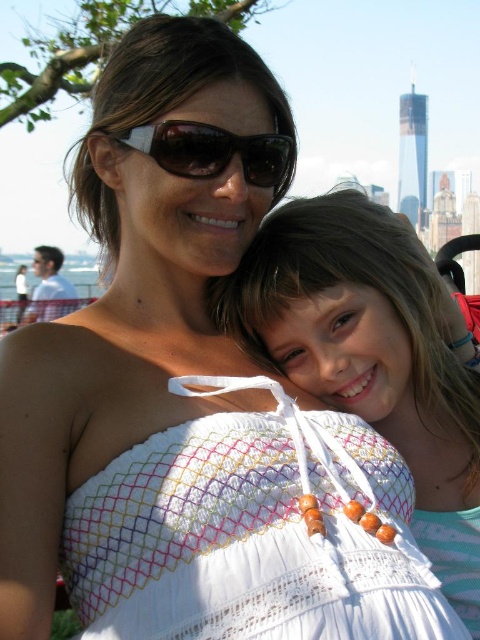
Question: Can you confirm if white crochet dress at center is positioned below matte black sunglasses at upper center?

Choices:
 (A) yes
 (B) no

Answer: (A)

Question: Which point is farther from the camera taking this photo?

Choices:
 (A) (179, 563)
 (B) (140, 131)

Answer: (B)

Question: Which object is positioned farthest from the white lace dress at center?

Choices:
 (A) matte black sunglasses at upper center
 (B) white crochet dress at center

Answer: (A)

Question: Which object is the farthest from the matte black sunglasses at upper center?

Choices:
 (A) white crochet dress at center
 (B) white lace dress at center

Answer: (A)

Question: Does white crochet dress at center appear on the left side of matte black sunglasses at upper center?

Choices:
 (A) yes
 (B) no

Answer: (B)

Question: Is white crochet dress at center below matte black sunglasses at upper center?

Choices:
 (A) yes
 (B) no

Answer: (A)